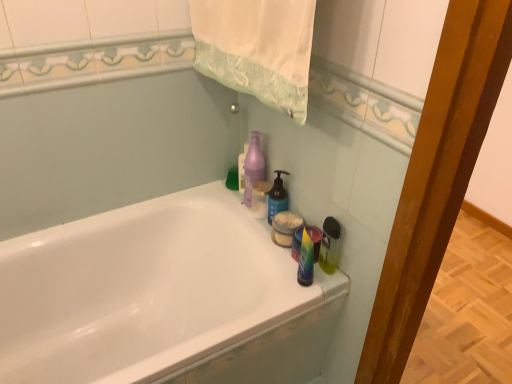
Question: From the image's perspective, would you say white fabric towel at upper center is shown under blue matte bottle at upper right, placed as the third cleaning product when sorted from left to right?

Choices:
 (A) no
 (B) yes

Answer: (A)

Question: Does white fabric towel at upper center appear on the right side of blue matte bottle at upper right, placed as the third cleaning product when sorted from left to right?

Choices:
 (A) yes
 (B) no

Answer: (B)

Question: Does white fabric towel at upper center have a greater height compared to blue matte bottle at upper right, arranged as the second cleaning product when viewed from the right?

Choices:
 (A) no
 (B) yes

Answer: (B)

Question: From a real-world perspective, is white fabric towel at upper center located higher than blue matte bottle at upper right, arranged as the second cleaning product when viewed from the right?

Choices:
 (A) yes
 (B) no

Answer: (A)

Question: Is white fabric towel at upper center closer to camera compared to blue matte bottle at upper right, placed as the third cleaning product when sorted from left to right?

Choices:
 (A) no
 (B) yes

Answer: (B)

Question: Considering the positions of point (263, 39) and point (243, 188), is point (263, 39) closer or farther from the camera than point (243, 188)?

Choices:
 (A) farther
 (B) closer

Answer: (B)

Question: Based on their sizes in the image, would you say white fabric towel at upper center is bigger or smaller than purple matte bottle at upper center, which appears as the fourth cleaning product when viewed from the right?

Choices:
 (A) big
 (B) small

Answer: (A)

Question: From their relative heights in the image, would you say white fabric towel at upper center is taller or shorter than purple matte bottle at upper center, positioned as the first cleaning product in left-to-right order?

Choices:
 (A) short
 (B) tall

Answer: (B)

Question: Is white fabric towel at upper center to the left or to the right of purple matte bottle at upper center, which appears as the fourth cleaning product when viewed from the right, in the image?

Choices:
 (A) left
 (B) right

Answer: (B)

Question: In the image, is blue matte bottle at upper right, arranged as the second cleaning product when viewed from the right, positioned in front of or behind purple matte bottle at upper center, which appears as the fourth cleaning product when viewed from the right?

Choices:
 (A) behind
 (B) front

Answer: (B)

Question: Is blue matte bottle at upper right, arranged as the second cleaning product when viewed from the right, wider or thinner than purple matte bottle at upper center, positioned as the first cleaning product in left-to-right order?

Choices:
 (A) wide
 (B) thin

Answer: (A)

Question: Is blue matte bottle at upper right, placed as the third cleaning product when sorted from left to right, to the left or to the right of purple matte bottle at upper center, which appears as the fourth cleaning product when viewed from the right, in the image?

Choices:
 (A) right
 (B) left

Answer: (A)

Question: Looking at the image, does blue matte bottle at upper right, arranged as the second cleaning product when viewed from the right, seem bigger or smaller compared to purple matte bottle at upper center, which appears as the fourth cleaning product when viewed from the right?

Choices:
 (A) big
 (B) small

Answer: (A)

Question: Is purple matte pump bottle at upper center, the third cleaning product from the right, wider or thinner than white glossy bathtub at upper center?

Choices:
 (A) wide
 (B) thin

Answer: (B)

Question: From the image's perspective, relative to white glossy bathtub at upper center, is purple matte pump bottle at upper center, the third cleaning product from the right, above or below?

Choices:
 (A) below
 (B) above

Answer: (B)